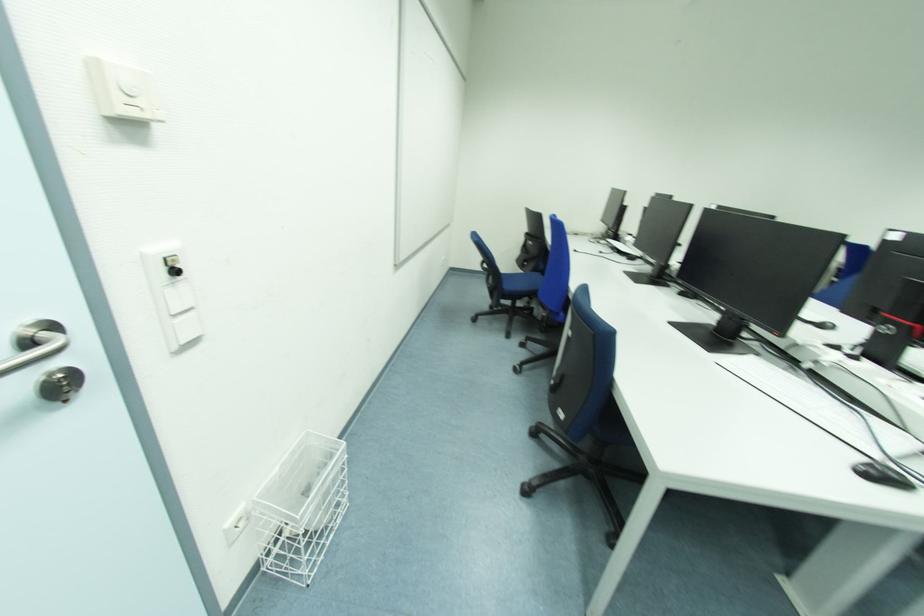
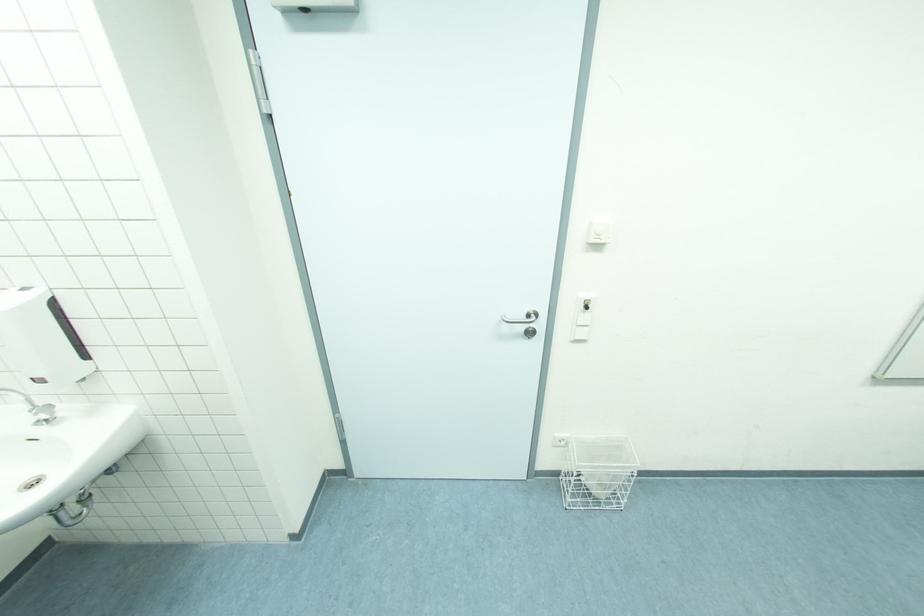
In the second image, find the point that corresponds to point (55, 375) in the first image.

(532, 329)